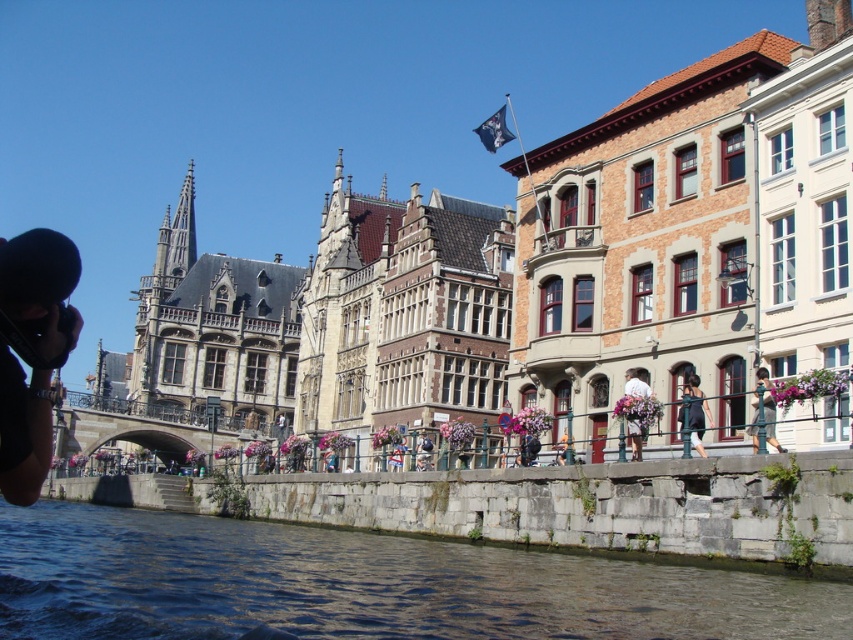
You are standing at the edge of the canal and want to take a photo that includes both the point at coordinates point (688, 428) and point (756, 381). Which point should you focus on first to ensure both are in clear view?

You should focus on point (688, 428) first because it is closer to the camera than point (756, 381), ensuring both points are in focus when using a shallow depth of field.